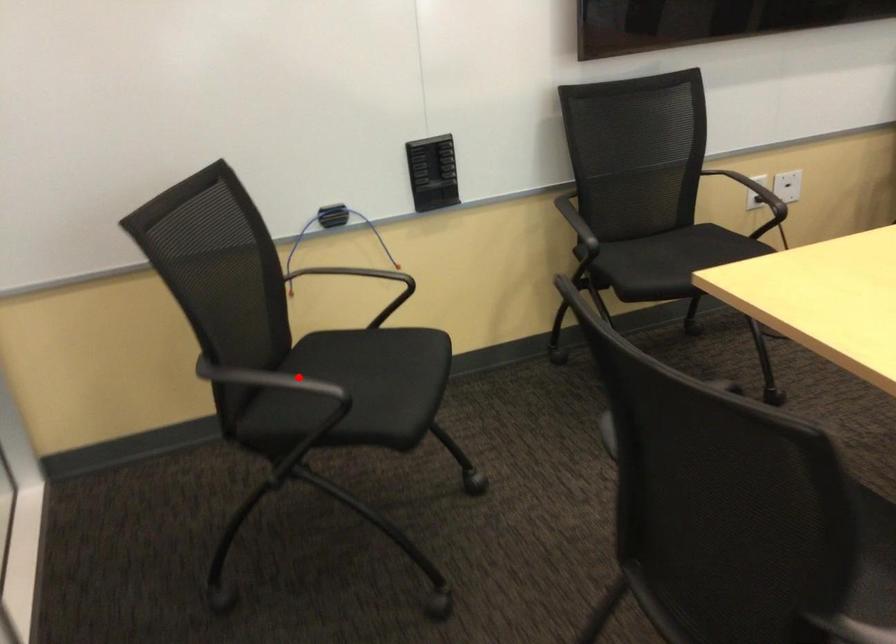
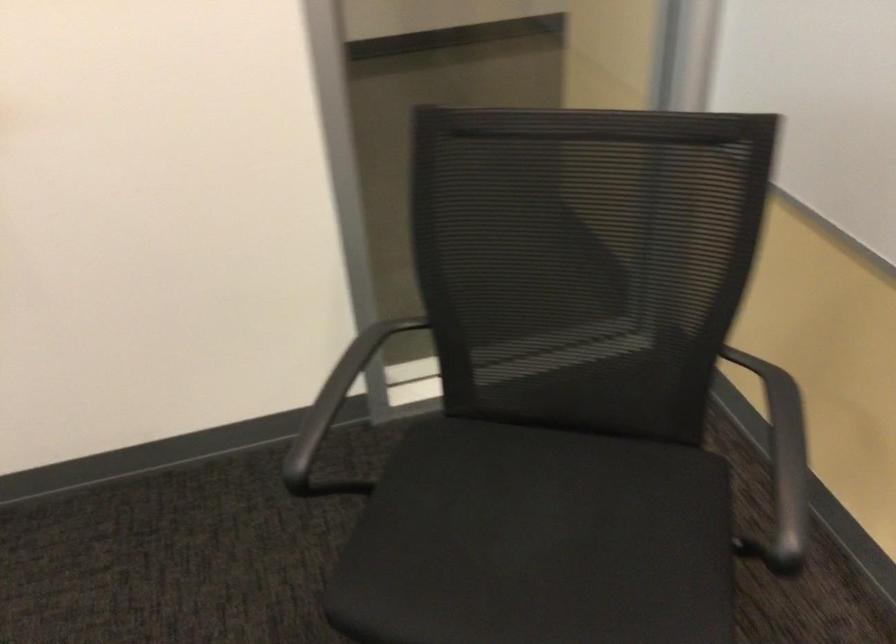
Question: I am providing you with two images of the same scene from different viewpoints. Given a red point in image1, look at the same physical point in image2. Is it:

Choices:
 (A) Closer to the viewpoint
 (B) Farther from the viewpoint

Answer: (A)